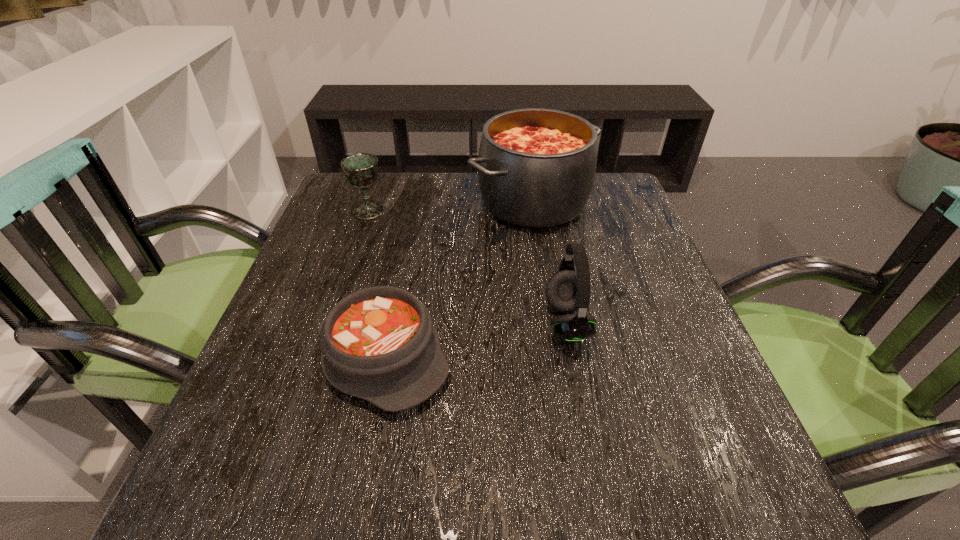
Find the location of a particular element. Image resolution: width=960 pixels, height=540 pixels. the right casserole is located at coordinates (536, 167).

Where is `the farther casserole`? Image resolution: width=960 pixels, height=540 pixels. the farther casserole is located at coordinates (536, 167).

Identify the location of headset. (566, 291).

Locate an element on the screen. the second shortest object is located at coordinates (361, 170).

Find the location of a particular element. This screenshot has height=540, width=960. the shorter casserole is located at coordinates (379, 344).

Identify the location of the nearer casserole. (379, 344).

The image size is (960, 540). I want to click on vacant space situated 0.160m on the front of the farther casserole, so click(546, 281).

Locate an element on the screen. The width and height of the screenshot is (960, 540). vacant space situated on the ear cups of the headset is located at coordinates (514, 322).

At what (x,y) coordinates should I click in order to perform the action: click on vacant space located 0.350m on the ear cups of the headset. Please return your answer as a coordinate pair (x, y). The width and height of the screenshot is (960, 540). Looking at the image, I should click on (359, 322).

The image size is (960, 540). Identify the location of blank area located 0.400m on the ear cups of the headset. (332, 322).